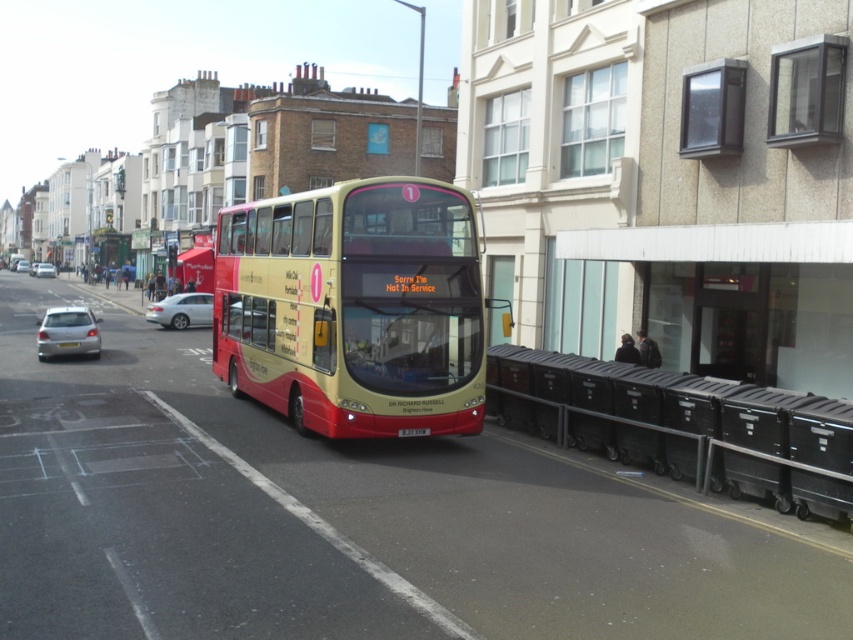
Question: Can you confirm if satin silver sedan at center is positioned to the left of black plastic license plate at center?

Choices:
 (A) yes
 (B) no

Answer: (A)

Question: Which object is farther from the camera taking this photo?

Choices:
 (A) satin silver sedan at center
 (B) silver metallic hatchback at lower left

Answer: (A)

Question: Is matte gold-decked bus at center above silver metallic car at center?

Choices:
 (A) no
 (B) yes

Answer: (A)

Question: Among these points, which one is nearest to the camera?

Choices:
 (A) (51, 356)
 (B) (479, 260)
 (C) (421, 435)
 (D) (53, 268)

Answer: (C)

Question: Which point is closer to the camera?

Choices:
 (A) silver metallic hatchback at lower left
 (B) yellow plastic license plate at center
 (C) silver metallic car at left
 (D) matte gold-decked bus at center

Answer: (D)

Question: Observing the image, what is the correct spatial positioning of matte gold-decked bus at center in reference to silver metallic car at center?

Choices:
 (A) below
 (B) above

Answer: (A)